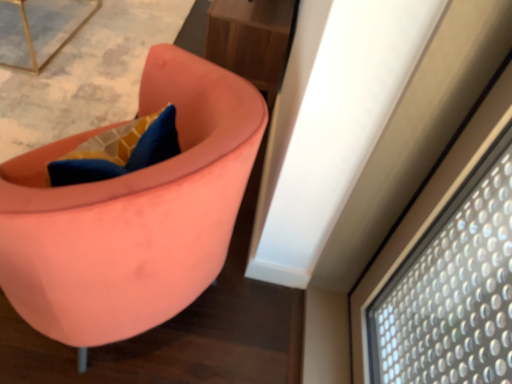
Question: Is wooden table at upper center closer to the viewer compared to matte pink chair at center?

Choices:
 (A) yes
 (B) no

Answer: (B)

Question: Is wooden table at upper center to the right of matte pink chair at center from the viewer's perspective?

Choices:
 (A) no
 (B) yes

Answer: (B)

Question: Is wooden table at upper center turned away from matte pink chair at center?

Choices:
 (A) yes
 (B) no

Answer: (B)

Question: Considering the relative sizes of wooden table at upper center and matte pink chair at center in the image provided, is wooden table at upper center wider than matte pink chair at center?

Choices:
 (A) no
 (B) yes

Answer: (A)

Question: Is wooden table at upper center not inside matte pink chair at center?

Choices:
 (A) yes
 (B) no

Answer: (A)

Question: Looking at their shapes, would you say metallic gold table at upper left is wider or thinner than wooden table at upper center?

Choices:
 (A) thin
 (B) wide

Answer: (B)

Question: Would you say metallic gold table at upper left is inside or outside wooden table at upper center?

Choices:
 (A) outside
 (B) inside

Answer: (A)

Question: From a real-world perspective, relative to wooden table at upper center, is metallic gold table at upper left vertically above or below?

Choices:
 (A) below
 (B) above

Answer: (A)

Question: Based on their sizes in the image, would you say metallic gold table at upper left is bigger or smaller than wooden table at upper center?

Choices:
 (A) small
 (B) big

Answer: (A)

Question: Does point (87, 11) appear closer or farther from the camera than point (174, 211)?

Choices:
 (A) closer
 (B) farther

Answer: (B)

Question: Choose the correct answer: Is metallic gold table at upper left inside matte pink chair at center or outside it?

Choices:
 (A) outside
 (B) inside

Answer: (A)

Question: Based on their sizes in the image, would you say metallic gold table at upper left is bigger or smaller than matte pink chair at center?

Choices:
 (A) small
 (B) big

Answer: (A)

Question: Is metallic gold table at upper left to the left or to the right of matte pink chair at center in the image?

Choices:
 (A) left
 (B) right

Answer: (A)

Question: Is point (209, 11) closer or farther from the camera than point (42, 8)?

Choices:
 (A) farther
 (B) closer

Answer: (B)

Question: In terms of width, does wooden table at upper center look wider or thinner when compared to metallic gold table at upper left?

Choices:
 (A) thin
 (B) wide

Answer: (A)